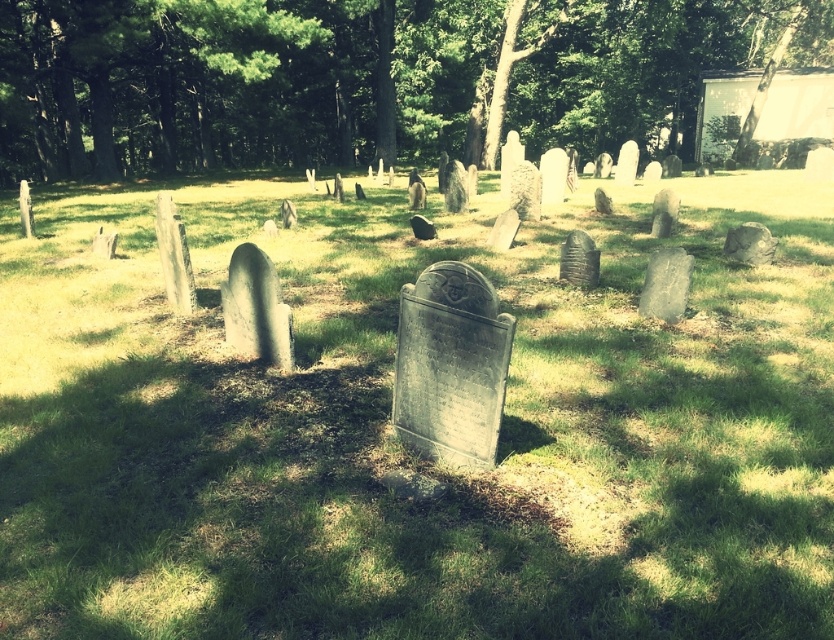
Can you confirm if green grassy at center is smaller than green leafy tree at upper center?

Yes.

Can you confirm if green grassy at center is thinner than green leafy tree at upper center?

Yes.

Between point (757, 602) and point (269, 36), which one is positioned behind?

Point (269, 36)

I want to click on green grassy at center, so click(398, 442).